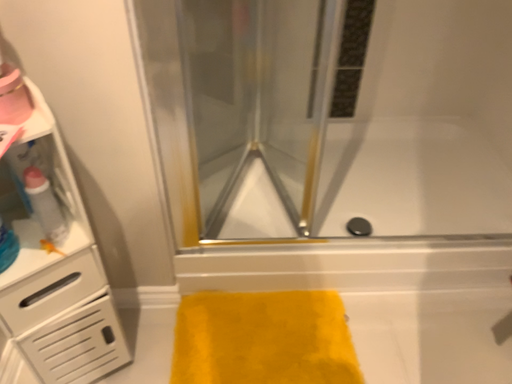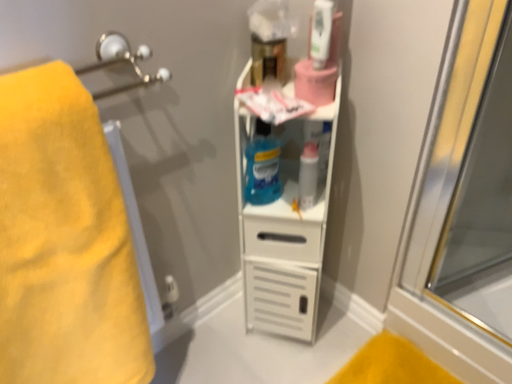
Question: How did the camera likely rotate when shooting the video?

Choices:
 (A) rotated downward
 (B) rotated upward

Answer: (B)